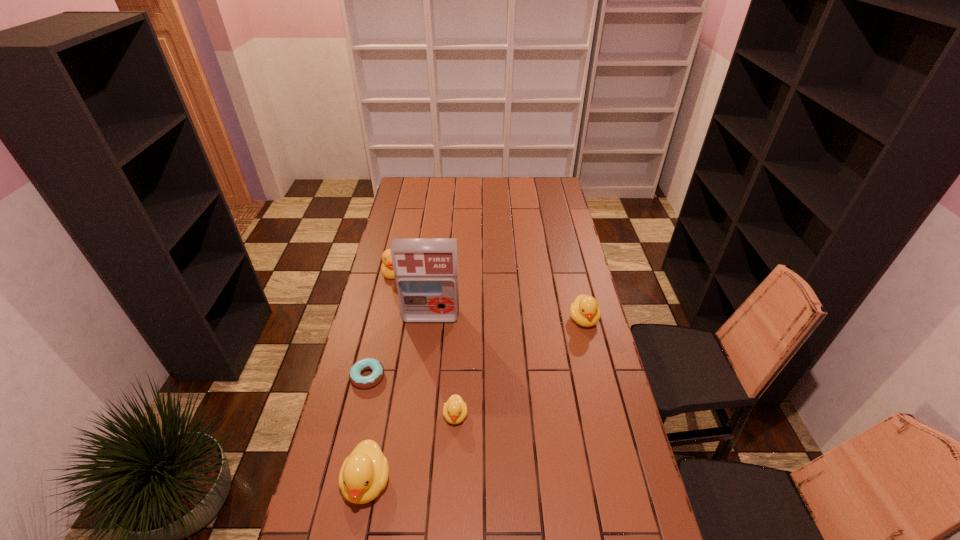
You are a GUI agent. You are given a task and a screenshot of the screen. Output one action in this format:
    pyautogui.click(x=<x>, y=<y>)
    Task: Click on the vacant region between the second duckling from right to left and the nearest duckling
    
    Given the screenshot: What is the action you would take?
    pyautogui.click(x=411, y=448)

I want to click on free spot between the tallest object and the nearest duckling, so click(399, 399).

Locate an element on the screen. The height and width of the screenshot is (540, 960). vacant space that's between the second tallest duckling and the farthest object is located at coordinates (489, 296).

Where is `free space between the second shortest duckling and the farthest object`? This screenshot has width=960, height=540. free space between the second shortest duckling and the farthest object is located at coordinates (489, 296).

You are a GUI agent. You are given a task and a screenshot of the screen. Output one action in this format:
    pyautogui.click(x=<x>, y=<y>)
    Task: Click on the unoccupied area between the nearest object and the doughnut
    
    Given the screenshot: What is the action you would take?
    pyautogui.click(x=368, y=429)

The image size is (960, 540). I want to click on empty space between the second shortest duckling and the doughnut, so click(475, 348).

Identify which object is the fourth closest to the duck. Please provide its 2D coordinates. Your answer should be formatted as a tuple, i.e. [(x, y)], where the tuple contains the x and y coordinates of a point satisfying the conditions above.

[(584, 310)]

Image resolution: width=960 pixels, height=540 pixels. What are the coordinates of `the third closest object to the nearest object` in the screenshot? It's located at (426, 270).

Identify the location of the closest duckling to the farthest object. (455, 409).

Point out which duckling is positioned as the second nearest to the nearest duckling. Please provide its 2D coordinates. Your answer should be formatted as a tuple, i.e. [(x, y)], where the tuple contains the x and y coordinates of a point satisfying the conditions above.

[(584, 310)]